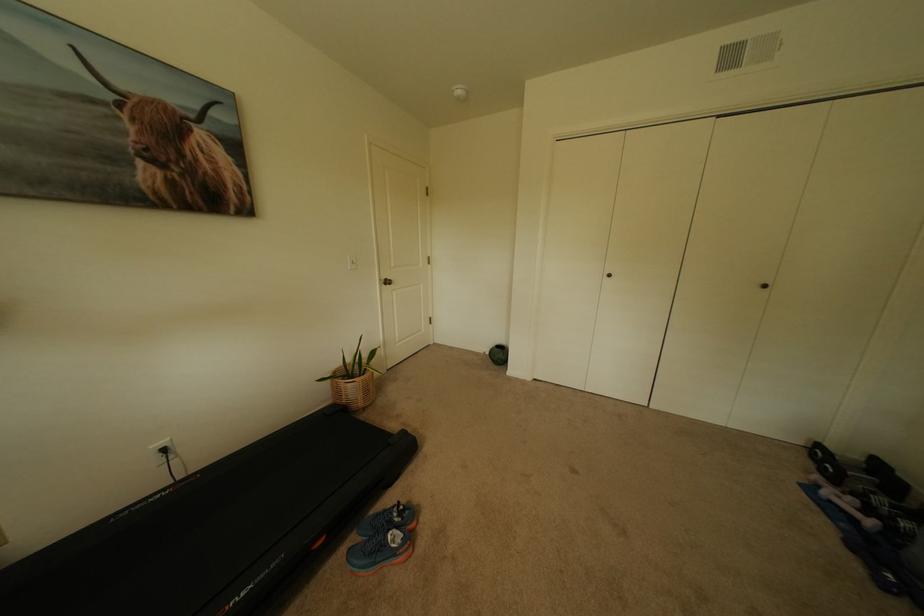
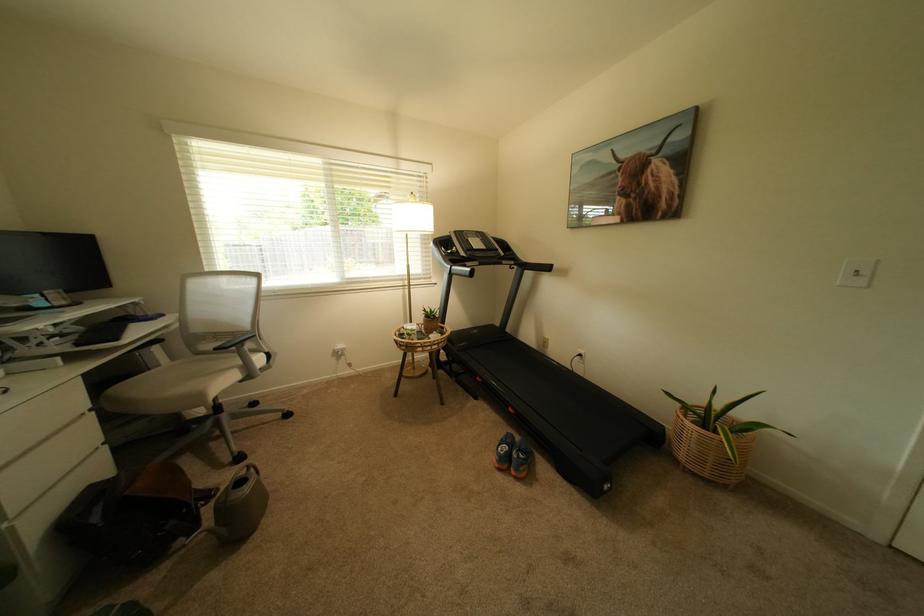
Locate, in the second image, the point that corresponds to point 361,262 in the first image.

(866, 272)